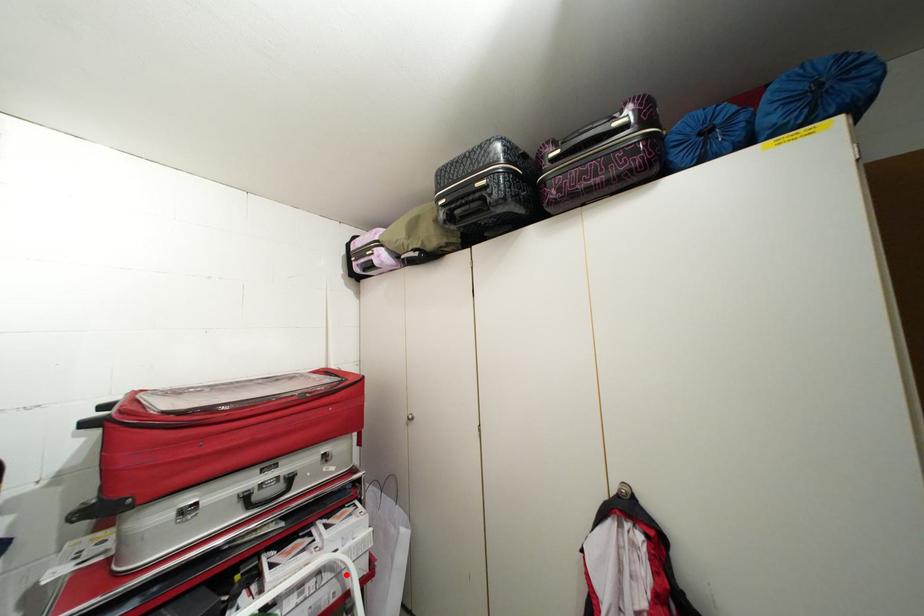
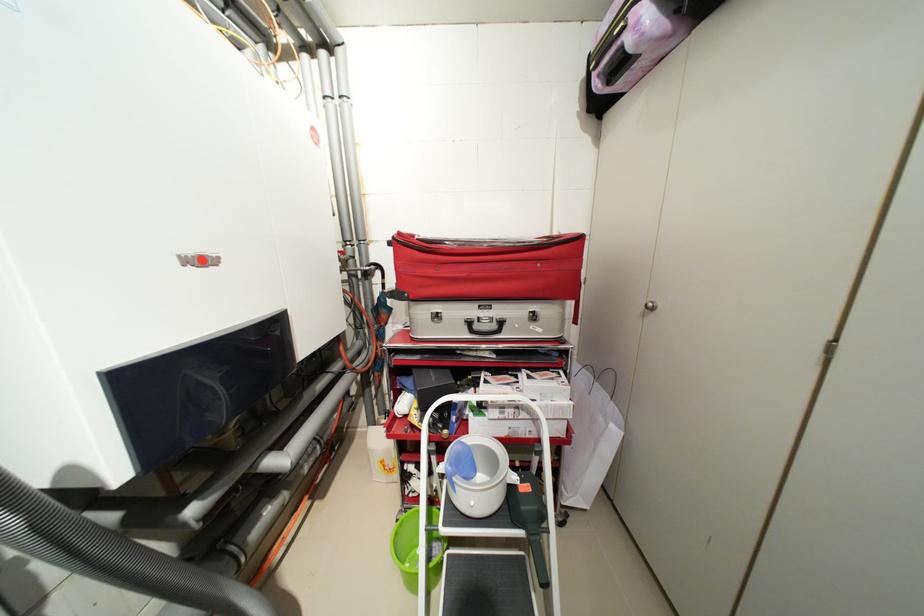
Question: I am providing you with two images of the same scene from different viewpoints. Image1 has a red point marked. In image2, the corresponding 3D location appears at what relative position? Reply with the corresponding letter.

Choices:
 (A) Closer
 (B) Farther

Answer: (B)